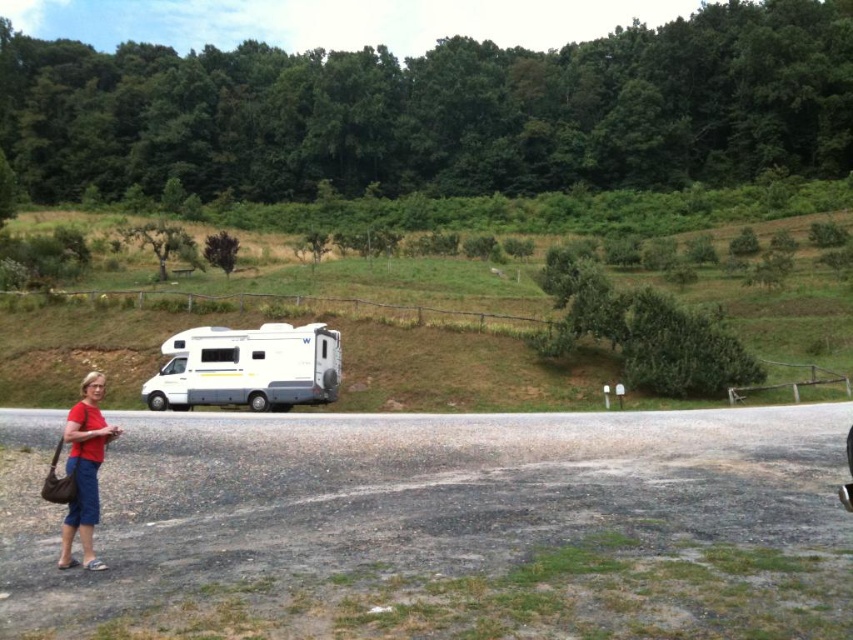
You are a delivery person trying to locate the matte red shirt at lower left. From your current position, where should you look relative to the white glossy recreational vehicle at center?

The white glossy recreational vehicle at center is located above the matte red shirt at lower left, so you should look below the white glossy recreational vehicle at center to find the matte red shirt at lower left.

You are a delivery person trying to park your truck in the area where the white glossy recreational vehicle at center and the matte red shirt at lower left are located. Based on the scene, which object takes up more space and would require more room to maneuver around?

The matte red shirt at lower left occupies more space than the white glossy recreational vehicle at center, so it would require more room to maneuver around.